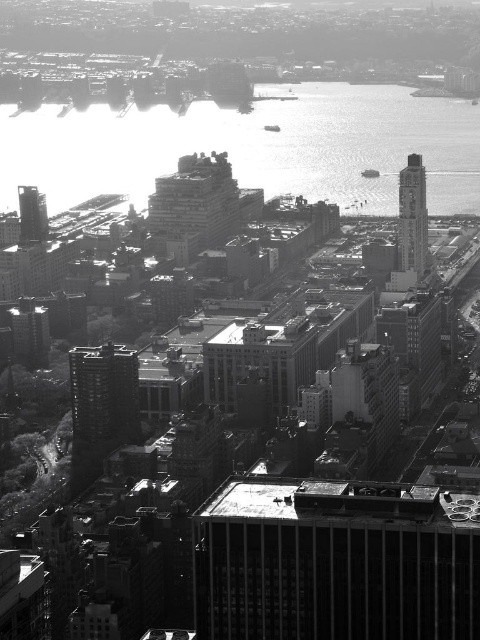
Question: Does concrete building at center have a lesser width compared to smooth concrete skyscraper at left?

Choices:
 (A) yes
 (B) no

Answer: (B)

Question: Which object appears closest to the camera in this image?

Choices:
 (A) reflective silver water at upper center
 (B) concrete building at center
 (C) smooth concrete skyscraper at left

Answer: (B)

Question: Estimate the real-world distances between objects in this image. Which object is closer to the reflective silver water at upper center?

Choices:
 (A) concrete building at center
 (B) smooth glass clock tower at right
 (C) smooth concrete building at center
 (D) smooth concrete skyscraper at left

Answer: (A)

Question: Does concrete building at center have a larger size compared to smooth concrete skyscraper at left?

Choices:
 (A) yes
 (B) no

Answer: (A)

Question: Is concrete building at center positioned in front of smooth glass clock tower at right?

Choices:
 (A) yes
 (B) no

Answer: (A)

Question: Which is farther from the concrete building at center?

Choices:
 (A) smooth concrete skyscraper at left
 (B) reflective silver water at upper center

Answer: (A)